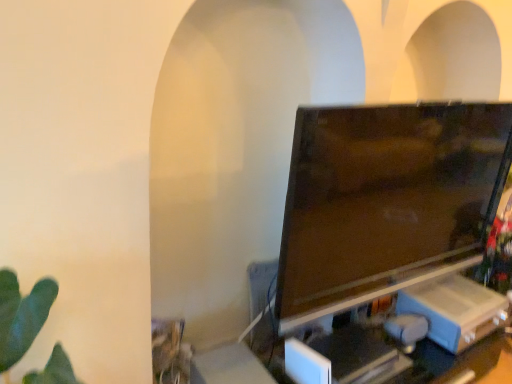
The height and width of the screenshot is (384, 512). I want to click on matte black tv at center, so click(386, 200).

What do you see at coordinates (386, 200) in the screenshot? The image size is (512, 384). I see `matte black tv at center` at bounding box center [386, 200].

Image resolution: width=512 pixels, height=384 pixels. Identify the location of black plastic computer desk at lower right. (403, 357).

This screenshot has height=384, width=512. What do you see at coordinates (403, 357) in the screenshot? I see `black plastic computer desk at lower right` at bounding box center [403, 357].

What is the approximate width of black plastic computer desk at lower right?

The width of black plastic computer desk at lower right is 16.91 inches.

The height and width of the screenshot is (384, 512). Find the location of `matte black tv at center`. matte black tv at center is located at coordinates (386, 200).

Considering the relative positions of matte black tv at center and black plastic computer desk at lower right in the image provided, is matte black tv at center to the left of black plastic computer desk at lower right from the viewer's perspective?

Correct, you'll find matte black tv at center to the left of black plastic computer desk at lower right.

Looking at this image, between matte black tv at center and black plastic computer desk at lower right, which one is positioned in front?

matte black tv at center is in front.

Which is further, (429, 202) or (369, 355)?

Positioned behind is point (429, 202).

From the image's perspective, between matte black tv at center and black plastic computer desk at lower right, who is located below?

black plastic computer desk at lower right is shown below in the image.

From a real-world perspective, is matte black tv at center positioned over black plastic computer desk at lower right based on gravity?

Yes, from a real-world perspective, matte black tv at center is above black plastic computer desk at lower right.

Does matte black tv at center have a greater width compared to black plastic computer desk at lower right?

Incorrect, the width of matte black tv at center does not surpass that of black plastic computer desk at lower right.

In the scene shown: Can you confirm if matte black tv at center is shorter than black plastic computer desk at lower right?

Incorrect, the height of matte black tv at center does not fall short of that of black plastic computer desk at lower right.

Considering the sizes of objects matte black tv at center and black plastic computer desk at lower right in the image provided, who is smaller, matte black tv at center or black plastic computer desk at lower right?

Smaller between the two is matte black tv at center.

Does matte black tv at center contain black plastic computer desk at lower right?

No, matte black tv at center does not contain black plastic computer desk at lower right.

Is matte black tv at center in contact with black plastic computer desk at lower right?

matte black tv at center and black plastic computer desk at lower right are clearly separated.

Could you tell me if matte black tv at center is turned towards black plastic computer desk at lower right?

No, matte black tv at center is not facing towards black plastic computer desk at lower right.

How different are the orientations of matte black tv at center and black plastic computer desk at lower right in degrees?

They differ by 4.23 degrees in their facing directions.

Consider the image. How much distance is there between matte black tv at center and black plastic computer desk at lower right?

matte black tv at center is 21.13 inches from black plastic computer desk at lower right.

Locate an element on the screen. This screenshot has height=384, width=512. television on the left side of black plastic computer desk at lower right is located at coordinates (386, 200).

Can you confirm if black plastic computer desk at lower right is positioned to the left of matte black tv at center?

In fact, black plastic computer desk at lower right is to the right of matte black tv at center.

Which object is further away from the camera taking this photo, black plastic computer desk at lower right or matte black tv at center?

black plastic computer desk at lower right is further from the camera.

Considering the positions of points (212, 352) and (386, 134), is point (212, 352) closer to camera compared to point (386, 134)?

That is False.

From the image's perspective, which one is positioned lower, black plastic computer desk at lower right or matte black tv at center?

black plastic computer desk at lower right appears lower in the image.

From a real-world perspective, between black plastic computer desk at lower right and matte black tv at center, who is vertically higher?

In real-world perspective, matte black tv at center is above.

Can you confirm if black plastic computer desk at lower right is wider than matte black tv at center?

Yes, black plastic computer desk at lower right is wider than matte black tv at center.

Who is taller, black plastic computer desk at lower right or matte black tv at center?

matte black tv at center is taller.

Is black plastic computer desk at lower right smaller than matte black tv at center?

Incorrect, black plastic computer desk at lower right is not smaller in size than matte black tv at center.

Could matte black tv at center be considered to be inside black plastic computer desk at lower right?

No, matte black tv at center is not surrounded by black plastic computer desk at lower right.

Is black plastic computer desk at lower right next to matte black tv at center and touching it?

No, black plastic computer desk at lower right is not touching matte black tv at center.

Based on the photo, is black plastic computer desk at lower right oriented away from matte black tv at center?

That's not correct — black plastic computer desk at lower right is not looking away from matte black tv at center.

Where is `computer desk beneath the matte black tv at center (from a real-world perspective)`? computer desk beneath the matte black tv at center (from a real-world perspective) is located at coordinates [x=403, y=357].

I want to click on computer desk on the right of matte black tv at center, so click(403, 357).

What are the coordinates of `television above the black plastic computer desk at lower right (from the image's perspective)` in the screenshot? It's located at (386, 200).